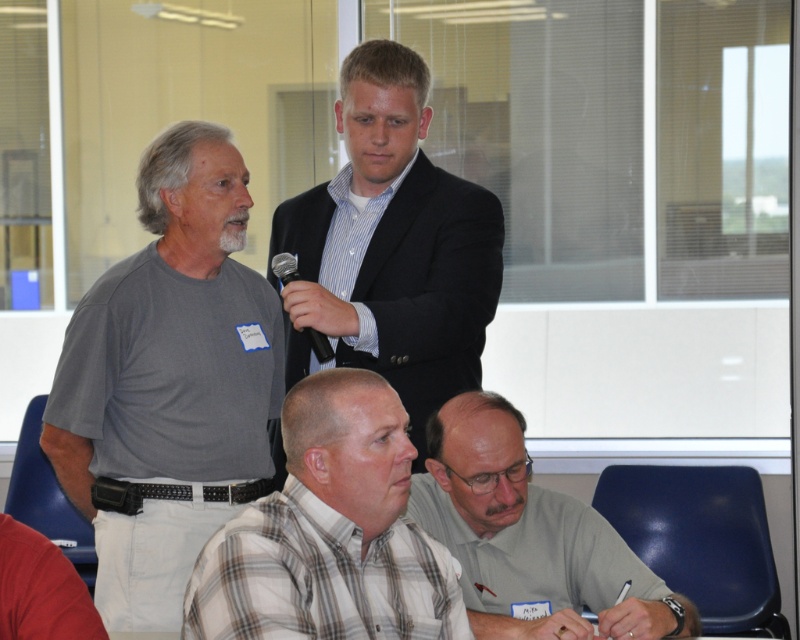
Question: Which of these objects is positioned farthest from the matte black suit at center?

Choices:
 (A) gray fabric shirt at lower center
 (B) plaid cotton shirt at lower center
 (C) gray cotton t-shirt at left

Answer: (B)

Question: Can you confirm if matte black suit at center is smaller than gray fabric shirt at lower center?

Choices:
 (A) yes
 (B) no

Answer: (B)

Question: Can you confirm if gray cotton t-shirt at left is thinner than plaid cotton shirt at lower center?

Choices:
 (A) yes
 (B) no

Answer: (B)

Question: Can you confirm if gray cotton t-shirt at left is thinner than plaid cotton shirt at lower center?

Choices:
 (A) no
 (B) yes

Answer: (A)

Question: Among these points, which one is nearest to the camera?

Choices:
 (A) (358, 141)
 (B) (430, 429)
 (C) (290, 260)
 (D) (126, 330)

Answer: (D)

Question: Which of the following is the closest to the observer?

Choices:
 (A) (392, 172)
 (B) (554, 499)
 (C) (110, 316)

Answer: (C)